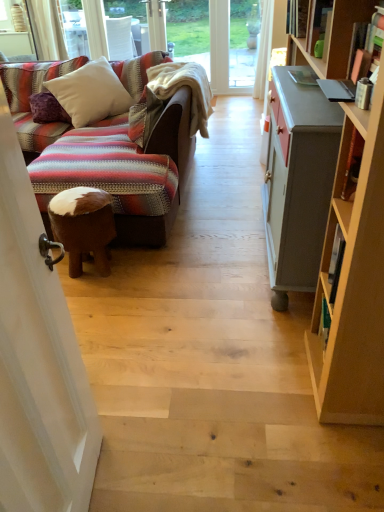
Question: From the image's perspective, does hardcover book at upper right appear lower than transparent glass screen door at upper left?

Choices:
 (A) no
 (B) yes

Answer: (A)

Question: Can transparent glass screen door at upper left be found inside hardcover book at upper right?

Choices:
 (A) yes
 (B) no

Answer: (B)

Question: Can you confirm if hardcover book at upper right is positioned to the left of transparent glass screen door at upper left?

Choices:
 (A) no
 (B) yes

Answer: (A)

Question: Considering the relative sizes of hardcover book at upper right and transparent glass screen door at upper left in the image provided, is hardcover book at upper right taller than transparent glass screen door at upper left?

Choices:
 (A) yes
 (B) no

Answer: (B)

Question: From a real-world perspective, is hardcover book at upper right located higher than transparent glass screen door at upper left?

Choices:
 (A) no
 (B) yes

Answer: (B)

Question: Is purple velvet pillow at left, acting as the 2th pillow starting from the right, taller or shorter than hardcover book at upper right?

Choices:
 (A) short
 (B) tall

Answer: (B)

Question: From a real-world perspective, is purple velvet pillow at left, acting as the 2th pillow starting from the right, above or below hardcover book at upper right?

Choices:
 (A) below
 (B) above

Answer: (A)

Question: Is purple velvet pillow at left, marked as the first pillow in a left-to-right arrangement, inside the boundaries of hardcover book at upper right, or outside?

Choices:
 (A) outside
 (B) inside

Answer: (A)

Question: Would you say purple velvet pillow at left, acting as the 2th pillow starting from the right, is to the left or to the right of hardcover book at upper right in the picture?

Choices:
 (A) right
 (B) left

Answer: (B)

Question: Is transparent glass screen door at upper left bigger or smaller than white soft cushion at upper left, which ranks as the 1th pillow in right-to-left order?

Choices:
 (A) small
 (B) big

Answer: (A)

Question: In terms of width, does transparent glass screen door at upper left look wider or thinner when compared to white soft cushion at upper left, which ranks as the 1th pillow in right-to-left order?

Choices:
 (A) wide
 (B) thin

Answer: (B)

Question: Considering their positions, is transparent glass screen door at upper left located in front of or behind white soft cushion at upper left, marked as the 2th pillow in a left-to-right arrangement?

Choices:
 (A) front
 (B) behind

Answer: (A)

Question: Is point pos(18,339) positioned closer to the camera than point pos(89,76)?

Choices:
 (A) closer
 (B) farther

Answer: (A)

Question: Looking at their shapes, would you say white soft cushion at upper left, marked as the 2th pillow in a left-to-right arrangement, is wider or thinner than purple velvet pillow at left, acting as the 2th pillow starting from the right?

Choices:
 (A) thin
 (B) wide

Answer: (B)

Question: From the image's perspective, is white soft cushion at upper left, marked as the 2th pillow in a left-to-right arrangement, above or below purple velvet pillow at left, marked as the first pillow in a left-to-right arrangement?

Choices:
 (A) above
 (B) below

Answer: (A)